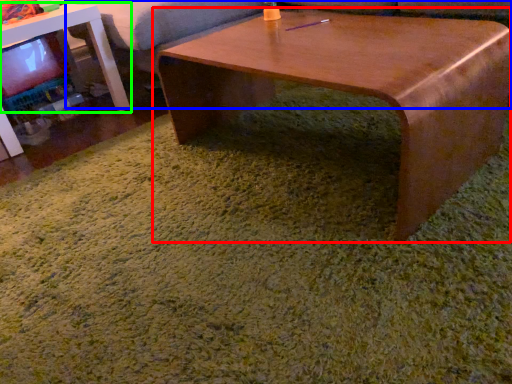
Question: Which is farther away from coffee table (highlighted by a red box)? couch (highlighted by a blue box) or table (highlighted by a green box)?

Choices:
 (A) couch
 (B) table

Answer: (B)